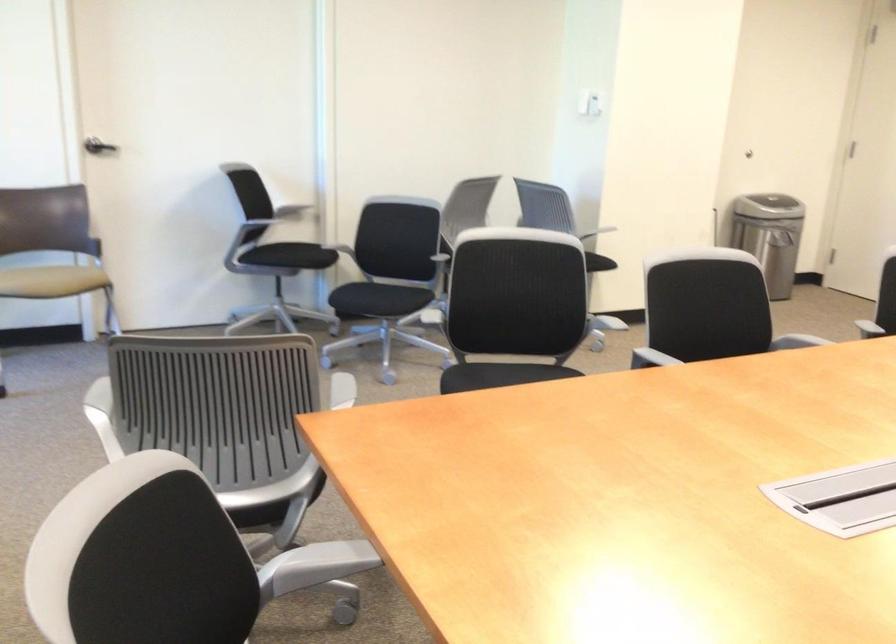
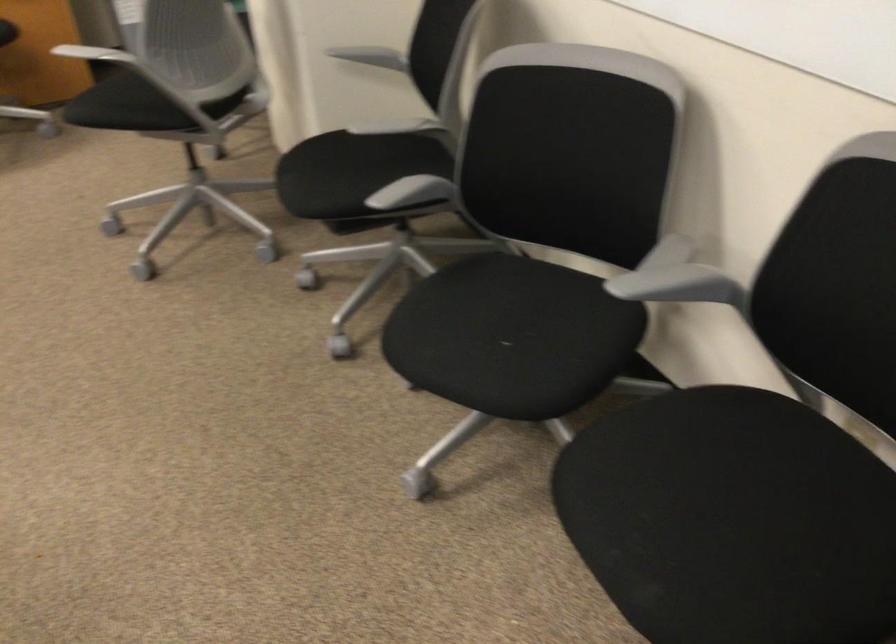
The first image is from the beginning of the video and the second image is from the end. How did the camera likely rotate when shooting the video?

The rotation direction of the camera is right-down.